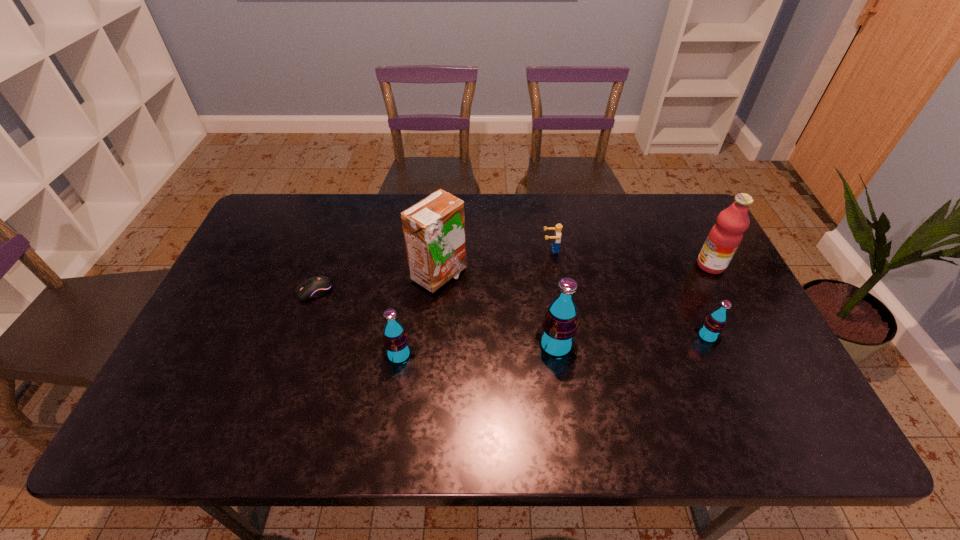
Where is `blank space located 0.370m on the face of the second shortest object`? blank space located 0.370m on the face of the second shortest object is located at coordinates (422, 249).

At what (x,y) coordinates should I click in order to perform the action: click on free space located 0.180m on the straw side of the carton. Please return your answer as a coordinate pair (x, y). This screenshot has width=960, height=540. Looking at the image, I should click on (528, 275).

Where is `object present at the near edge`? Image resolution: width=960 pixels, height=540 pixels. object present at the near edge is located at coordinates pos(396,347).

Where is `soda present at the right edge`? The width and height of the screenshot is (960, 540). soda present at the right edge is located at coordinates (709, 332).

Locate an element on the screen. fruit juice located in the right edge section of the desktop is located at coordinates (725, 236).

In the image, there is a desktop. At what (x,y) coordinates should I click in order to perform the action: click on vacant area at the far edge. Please return your answer as a coordinate pair (x, y). Looking at the image, I should click on (348, 237).

Identify the location of vacant space at the near edge of the desktop. (529, 377).

The image size is (960, 540). Identify the location of vacant space at the left edge of the desktop. 234,352.

In the image, there is a desktop. Where is `vacant space at the right edge`? vacant space at the right edge is located at coordinates (683, 255).

Where is `vacant space at the far left corner`? vacant space at the far left corner is located at coordinates (290, 198).